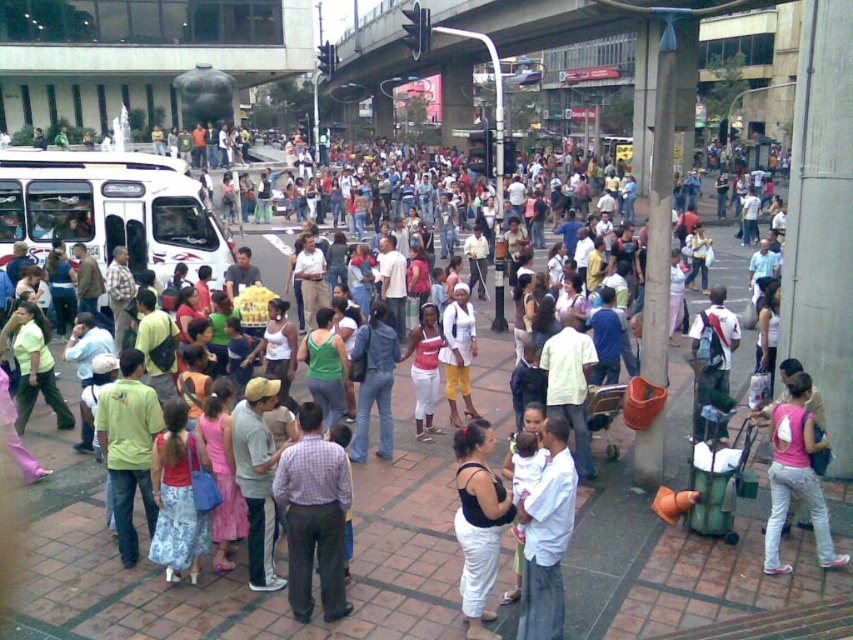
Who is more forward, (x=798, y=406) or (x=456, y=378)?

Point (x=798, y=406)

The width and height of the screenshot is (853, 640). In order to click on pink fabric bag at center in this screenshot , I will do `click(796, 476)`.

This screenshot has width=853, height=640. I want to click on pink fabric bag at center, so click(x=796, y=476).

Is white cotton shirt at center positioned in front of jeans at center?

Yes, it is in front of jeans at center.

Between white cotton shirt at center and jeans at center, which one appears on the left side from the viewer's perspective?

Positioned to the left is jeans at center.

Is point (544, 595) positioned in front of point (381, 444)?

Yes.

Identify the location of white cotton shirt at center. (547, 536).

Is plaid shirt at center above yellow cotton pants at center?

Incorrect, plaid shirt at center is not positioned above yellow cotton pants at center.

At what (x,y) coordinates should I click in order to perform the action: click on plaid shirt at center. Please return your answer as a coordinate pair (x, y). The height and width of the screenshot is (640, 853). Looking at the image, I should click on (314, 515).

Is point (300, 532) less distant than point (469, 413)?

Yes, point (300, 532) is in front of point (469, 413).

Where is `plaid shirt at center`? The height and width of the screenshot is (640, 853). plaid shirt at center is located at coordinates (314, 515).